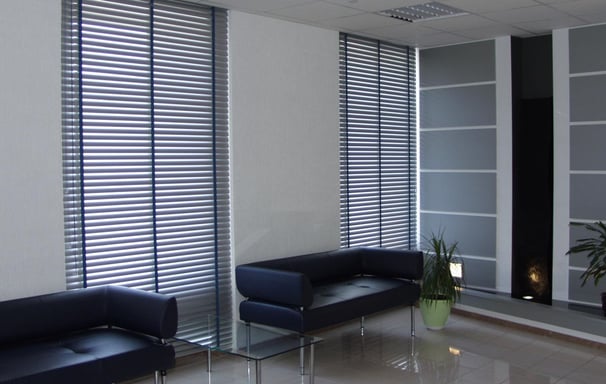
The height and width of the screenshot is (384, 606). I want to click on ceiling vent, so click(431, 15).